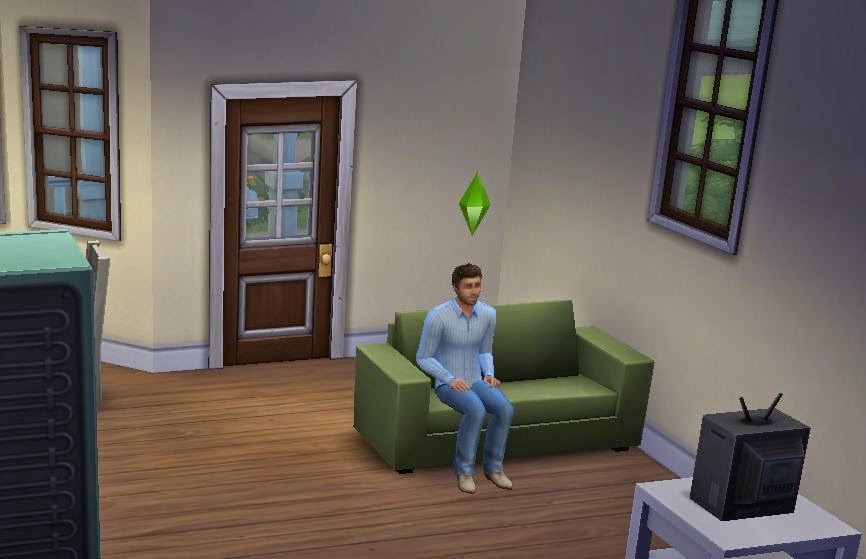
The width and height of the screenshot is (866, 559). In order to click on tv in this screenshot , I will do `click(757, 478)`.